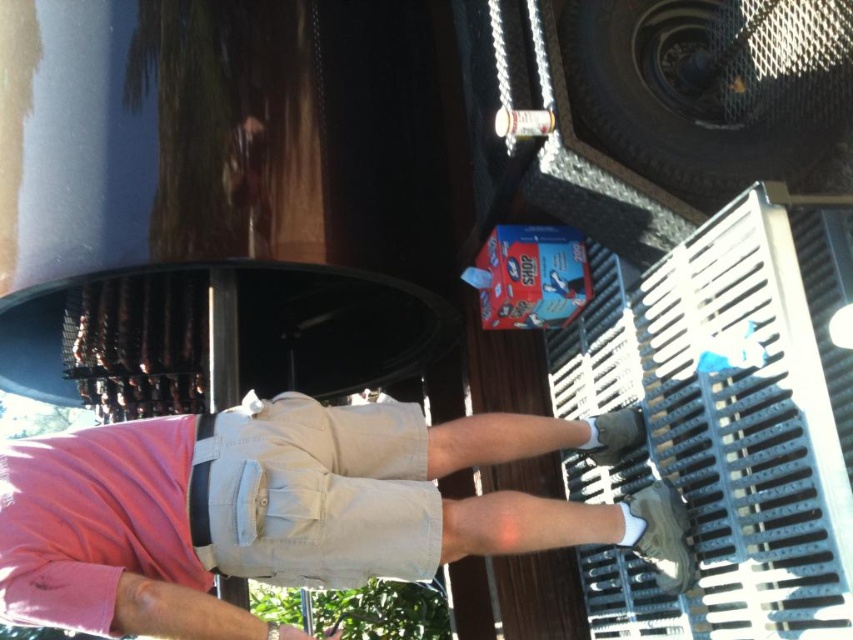
Question: Which object appears closest to the camera in this image?

Choices:
 (A) khaki cotton shorts at center
 (B) pink cotton shirt at upper left

Answer: (B)

Question: Does pink cotton shirt at upper left appear on the right side of khaki cotton shorts at center?

Choices:
 (A) yes
 (B) no

Answer: (A)

Question: Which point is farther to the camera?

Choices:
 (A) khaki cotton shorts at center
 (B) pink cotton shirt at upper left

Answer: (A)

Question: Does pink cotton shirt at upper left have a smaller size compared to khaki cotton shorts at center?

Choices:
 (A) yes
 (B) no

Answer: (B)

Question: Which point is farther from the camera taking this photo?

Choices:
 (A) (311, 513)
 (B) (68, 452)

Answer: (B)

Question: Is pink cotton shirt at upper left positioned behind khaki cotton shorts at center?

Choices:
 (A) no
 (B) yes

Answer: (A)